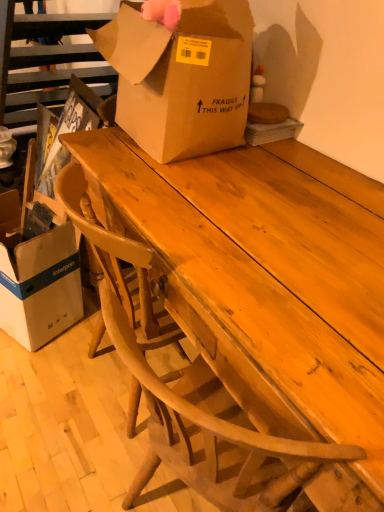
Where is `empty space that is to the right of brown cardboard box at center, the first box from the top`? Image resolution: width=384 pixels, height=512 pixels. empty space that is to the right of brown cardboard box at center, the first box from the top is located at coordinates (308, 173).